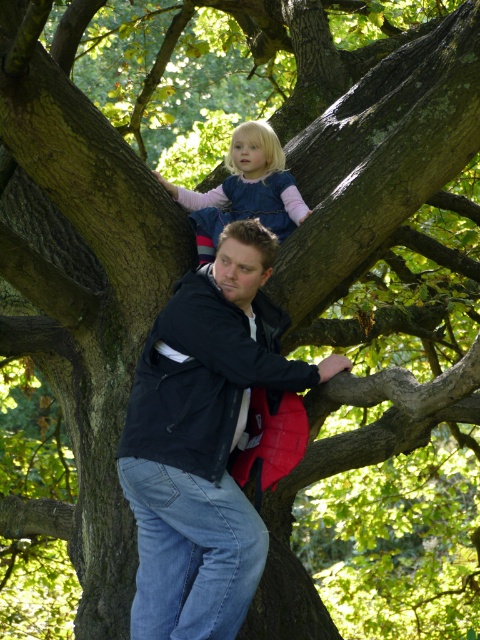
Question: Considering the relative positions of black softshell jacket at center and blue denim dress at upper center in the image provided, where is black softshell jacket at center located with respect to blue denim dress at upper center?

Choices:
 (A) above
 (B) below

Answer: (B)

Question: Does black softshell jacket at center have a greater width compared to blue denim dress at upper center?

Choices:
 (A) yes
 (B) no

Answer: (A)

Question: Among these objects, which one is nearest to the camera?

Choices:
 (A) black softshell jacket at center
 (B) blue denim dress at upper center

Answer: (A)

Question: Which point appears closest to the camera in this image?

Choices:
 (A) (217, 502)
 (B) (243, 134)

Answer: (A)

Question: Which point appears closest to the camera in this image?

Choices:
 (A) (226, 500)
 (B) (264, 189)

Answer: (A)

Question: Is black softshell jacket at center bigger than blue denim dress at upper center?

Choices:
 (A) no
 (B) yes

Answer: (B)